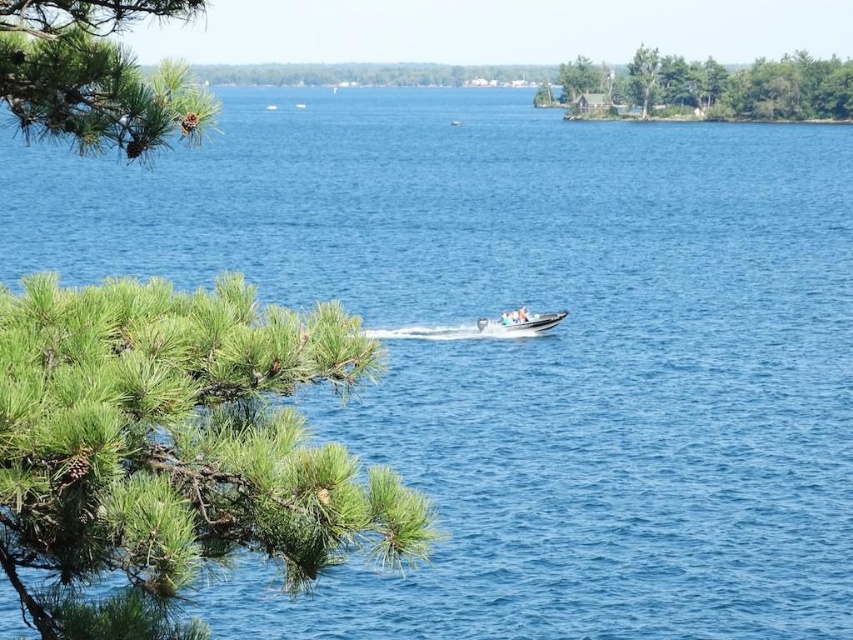
Question: Is green pine cone at upper left to the left of green leafy trees at upper right from the viewer's perspective?

Choices:
 (A) yes
 (B) no

Answer: (A)

Question: Does green needle-like leaves at left appear on the left side of green leafy trees at upper right?

Choices:
 (A) no
 (B) yes

Answer: (B)

Question: Does green matte tree at upper center appear under white plastic boat at center?

Choices:
 (A) yes
 (B) no

Answer: (B)

Question: Among these objects, which one is nearest to the camera?

Choices:
 (A) green needle-like leaves at left
 (B) white plastic boat at center

Answer: (A)

Question: Which point is farther to the camera?

Choices:
 (A) green leafy trees at upper right
 (B) green matte tree at upper center
 (C) green pine cone at upper left
 (D) green needle-like leaves at left

Answer: (B)

Question: Which of the following is the closest to the observer?

Choices:
 (A) green leafy trees at upper right
 (B) green matte tree at upper center

Answer: (A)